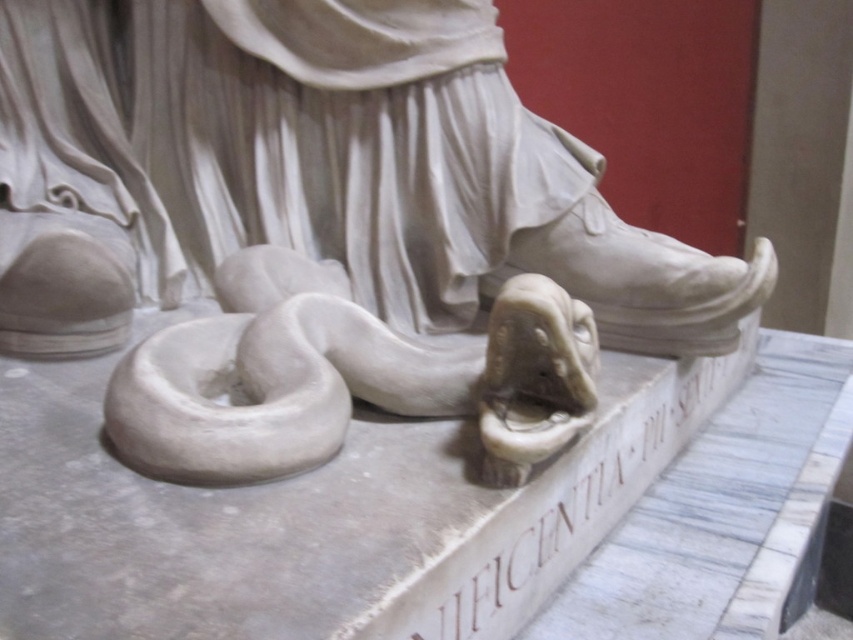
Question: Can you confirm if white marble snake at lower left is bigger than white marble snake at lower center?

Choices:
 (A) no
 (B) yes

Answer: (B)

Question: Based on their relative distances, which object is nearer to the white marble snake at lower center?

Choices:
 (A) white marble snake at lower left
 (B) white matte bagel at lower left

Answer: (B)

Question: Is white marble snake at lower left smaller than white matte bagel at lower left?

Choices:
 (A) no
 (B) yes

Answer: (A)

Question: Is white marble snake at lower left smaller than white matte bagel at lower left?

Choices:
 (A) no
 (B) yes

Answer: (A)

Question: Which object is positioned closest to the white matte bagel at lower left?

Choices:
 (A) white marble snake at lower center
 (B) white marble snake at lower left

Answer: (A)

Question: Which point is closer to the camera?

Choices:
 (A) white matte bagel at lower left
 (B) white marble snake at lower center

Answer: (A)